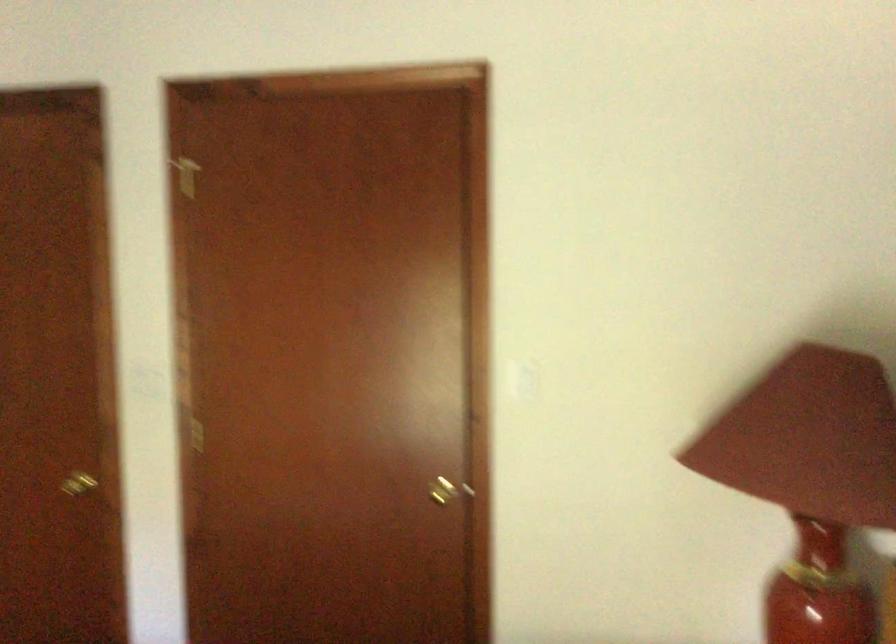
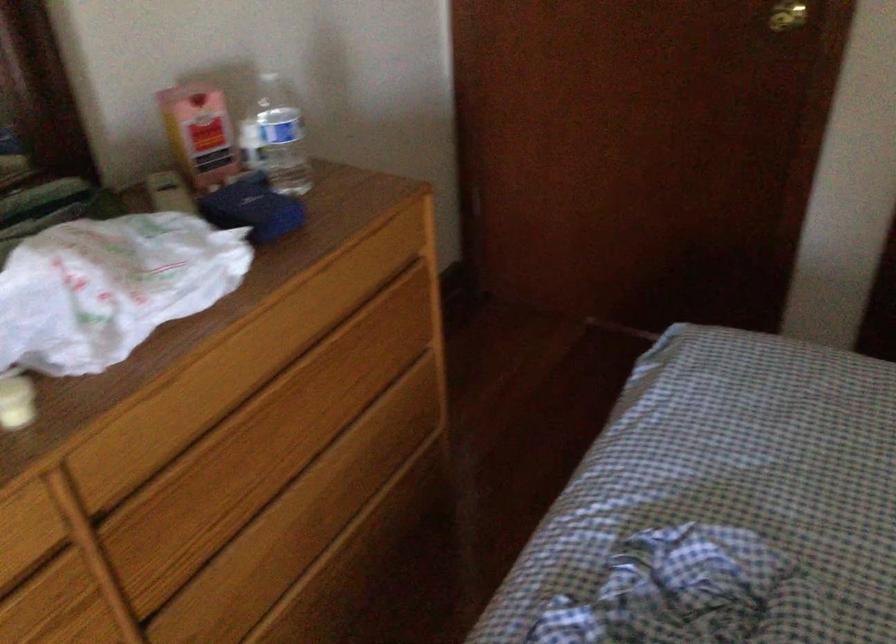
Find the pixel in the second image that matches the point at 82,483 in the first image.

(787, 15)